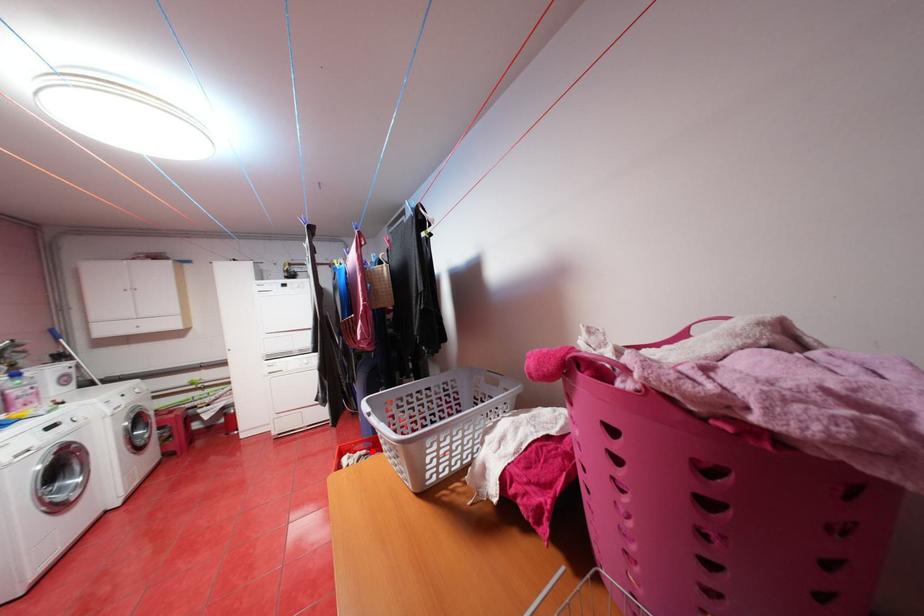
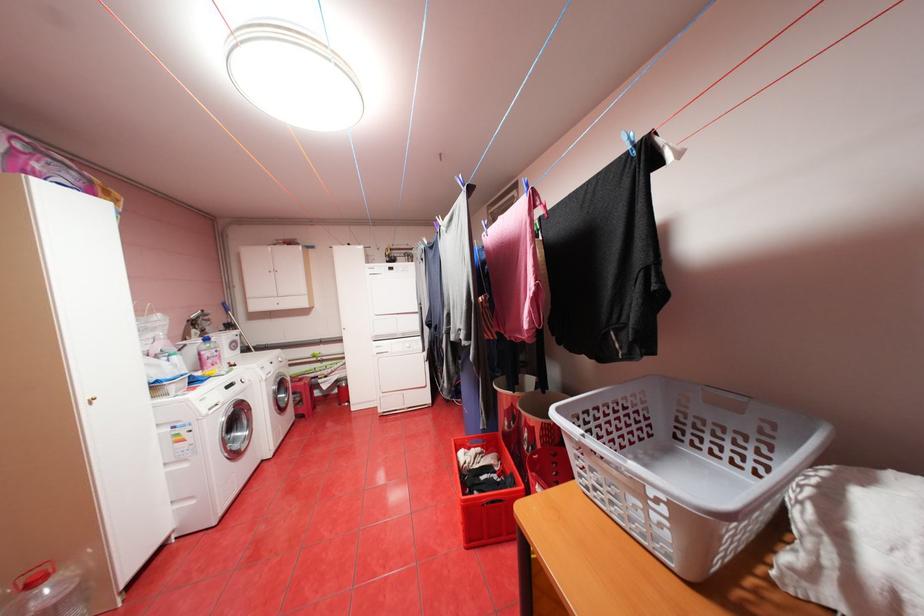
Where in the second image is the point corresponding to the highlighted location from the first image?

(488, 448)